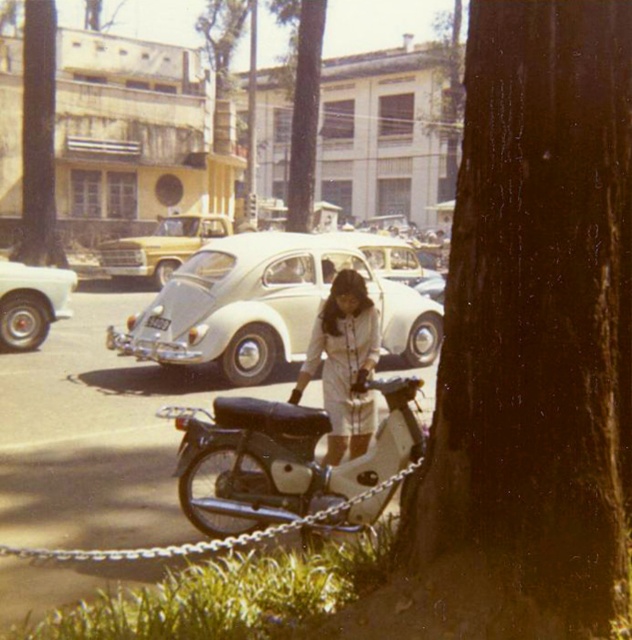
Question: Is white matte car at center closer to the viewer compared to white fabric dress at center?

Choices:
 (A) yes
 (B) no

Answer: (B)

Question: Which of the following is the closest to the observer?

Choices:
 (A) (332, 385)
 (B) (13, 252)

Answer: (A)

Question: Considering the relative positions of white fabric dress at center and yellow matte car at center in the image provided, where is white fabric dress at center located with respect to yellow matte car at center?

Choices:
 (A) left
 (B) right

Answer: (B)

Question: Among these objects, which one is nearest to the camera?

Choices:
 (A) brown rough tree at upper left
 (B) white glossy sedan at left
 (C) brown rough bark at center
 (D) black matte motorcycle at center

Answer: (C)

Question: Estimate the real-world distances between objects in this image. Which object is farther from the green rough bark tree at upper center?

Choices:
 (A) white matte car at center
 (B) brown rough tree at upper left

Answer: (A)

Question: Is green rough bark tree at upper center wider than white glossy sedan at left?

Choices:
 (A) yes
 (B) no

Answer: (A)